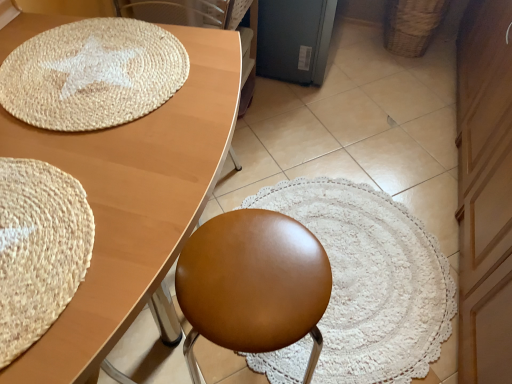
The width and height of the screenshot is (512, 384). In order to click on vacant space in front of woven brown basket at upper right in this screenshot , I will do `click(410, 76)`.